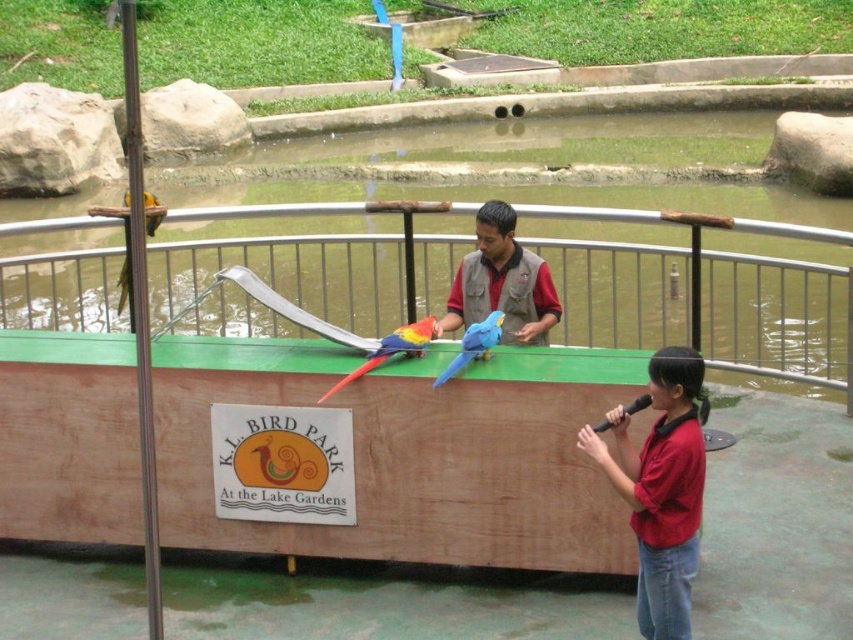
You are standing at the entrance of K.L. Bird Park and want to locate the green painted metal railing at center. According to the map coordinates, where is it positioned?

The green painted metal railing at center is positioned at coordinates point (706,307).

You are a tour guide at K.L. Bird Park and need to ensure safety between visitors and the birds. The park requires that the distance between the green painted metal railing at center and the blue matte parrot at center must be at least 3 meters to prevent visitors from reaching the birds. Based on the scene provided, does the current setup meet this safety requirement?

The distance between the green painted metal railing at center and the blue matte parrot at center is 4.09 meters, which exceeds the required 3 meters. Therefore, the current setup meets the safety requirement.